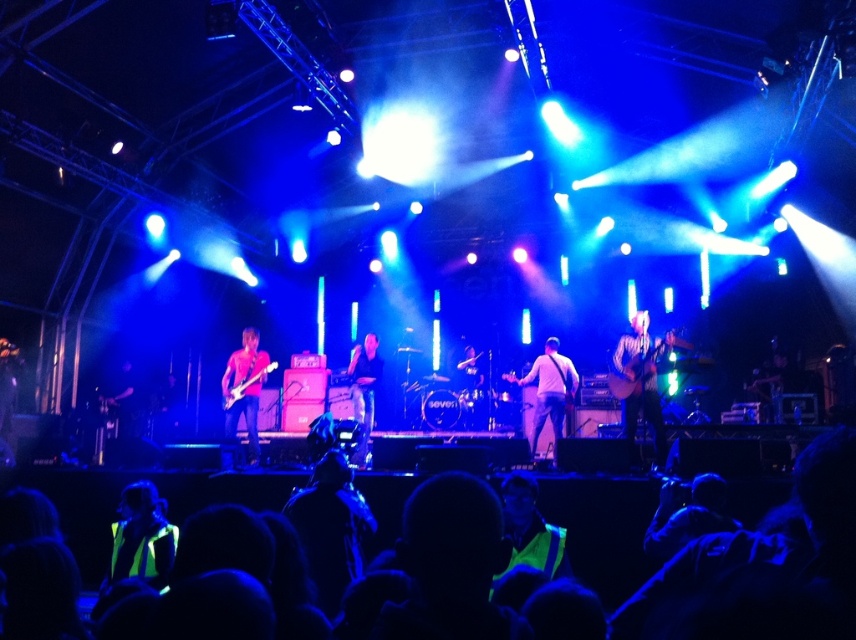
Question: Estimate the real-world distances between objects in this image. Which object is closer to the light brown leather guitar at center?

Choices:
 (A) pink matte guitar at center
 (B) neon yellow safety vest at lower left
 (C) matte black guitar at center
 (D) black leather guitar at center

Answer: (D)

Question: Is neon yellow safety vest at lower left closer to camera compared to light brown leather guitar at center?

Choices:
 (A) no
 (B) yes

Answer: (B)

Question: Estimate the real-world distances between objects in this image. Which object is closer to the matte black guitar at center?

Choices:
 (A) black leather guitar at center
 (B) shiny silver guitar at right
 (C) neon yellow safety vest at lower left
 (D) light brown leather guitar at center

Answer: (A)

Question: Is shiny silver guitar at right below matte black guitar at center?

Choices:
 (A) no
 (B) yes

Answer: (A)

Question: Is black leather guitar at center positioned behind matte black guitar at center?

Choices:
 (A) no
 (B) yes

Answer: (A)

Question: Among these points, which one is nearest to the camera?

Choices:
 (A) (473, 358)
 (B) (550, 381)
 (C) (254, 456)

Answer: (C)